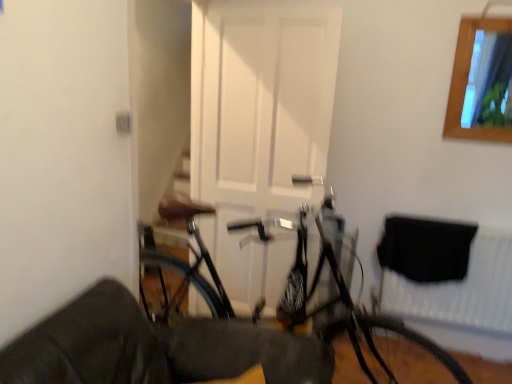
Question: From a real-world perspective, is wooden frame at upper right above or below white matte door at center?

Choices:
 (A) above
 (B) below

Answer: (A)

Question: Does point (495, 135) appear closer or farther from the camera than point (298, 24)?

Choices:
 (A) farther
 (B) closer

Answer: (A)

Question: Which is farther from the white matte door at center?

Choices:
 (A) wooden frame at upper right
 (B) shiny metallic bicycle at center
 (C) black fabric at lower right
 (D) shiny black tire at lower right

Answer: (A)

Question: Estimate the real-world distances between objects in this image. Which object is farther from the shiny metallic bicycle at center?

Choices:
 (A) black fabric at lower right
 (B) wooden frame at upper right
 (C) white matte door at center
 (D) shiny black tire at lower right

Answer: (B)